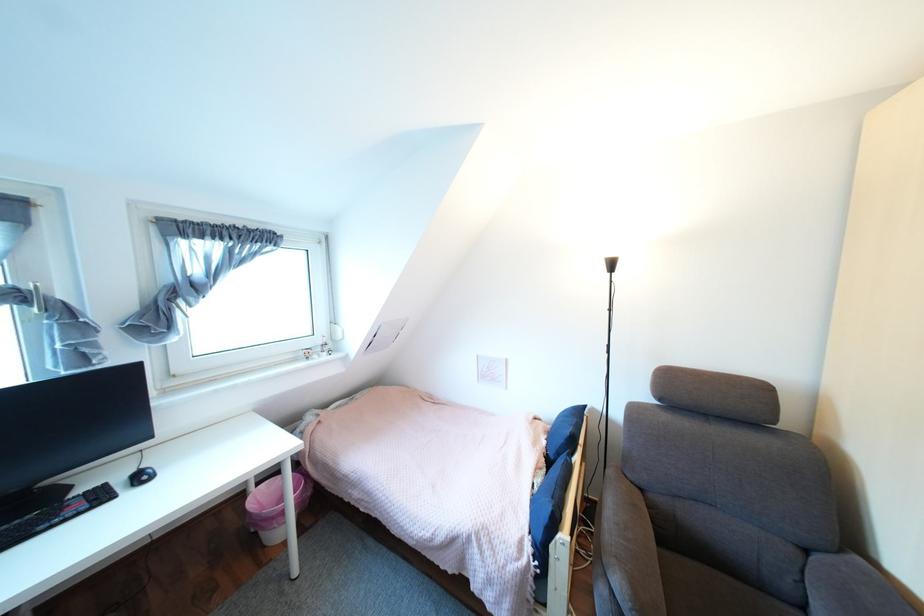
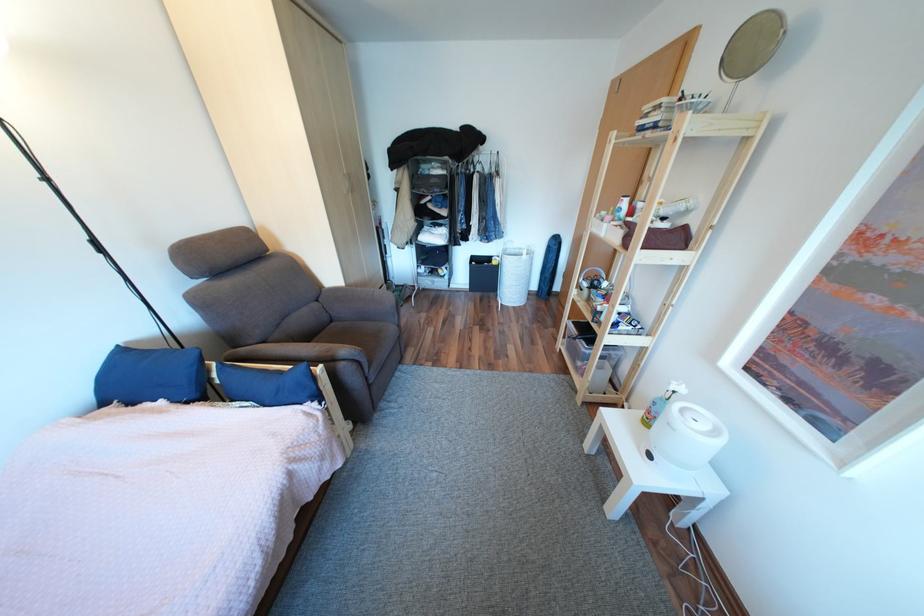
The point at (817,551) is marked in the first image. Where is the corresponding point in the second image?

(329, 301)